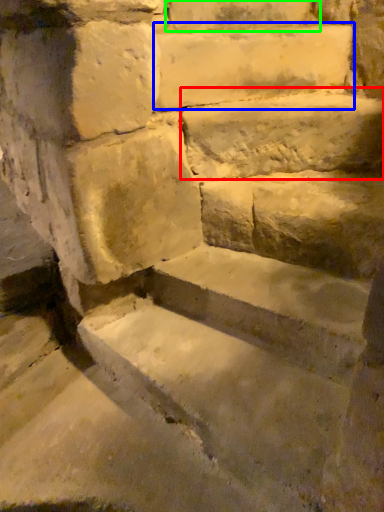
Question: Which object is positioned farthest from limestone (highlighted by a red box)? Select from limestone (highlighted by a blue box) and brick (highlighted by a green box).

Choices:
 (A) limestone
 (B) brick

Answer: (B)